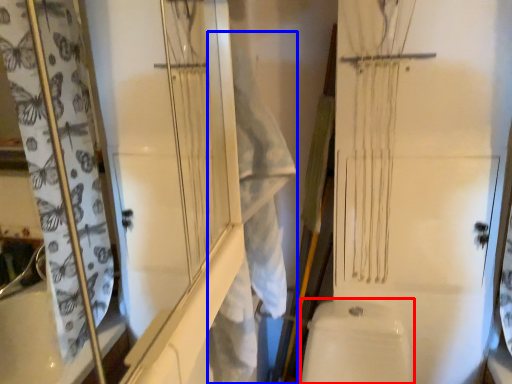
Question: Among these objects, which one is nearest to the camera, toilet bowl (highlighted by a red box) or laundry (highlighted by a blue box)?

Choices:
 (A) toilet bowl
 (B) laundry

Answer: (B)